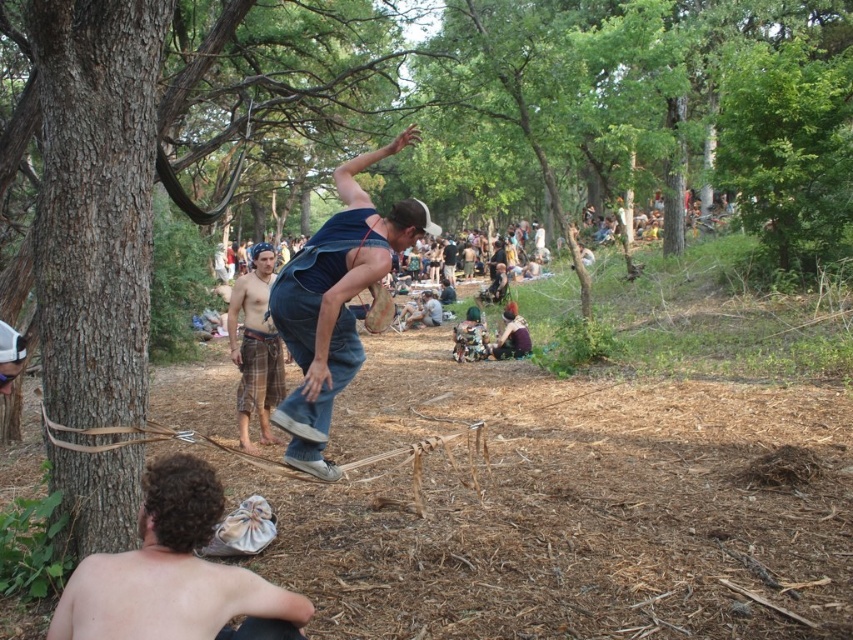
Who is taller, brown rough tree trunk at left or plaid fabric shorts at center?

Standing taller between the two is brown rough tree trunk at left.

I want to click on brown rough tree trunk at left, so click(x=96, y=202).

The image size is (853, 640). I want to click on brown rough tree trunk at left, so click(x=96, y=202).

The width and height of the screenshot is (853, 640). What are the coordinates of `brown rough tree trunk at left` in the screenshot? It's located at (96, 202).

Is curly hair at lower left to the right of plaid fabric shorts at center from the viewer's perspective?

Correct, you'll find curly hair at lower left to the right of plaid fabric shorts at center.

Can you confirm if curly hair at lower left is positioned above plaid fabric shorts at center?

Actually, curly hair at lower left is below plaid fabric shorts at center.

This screenshot has width=853, height=640. Find the location of `curly hair at lower left`. curly hair at lower left is located at coordinates (173, 573).

Between brown rough tree trunk at left and curly hair at lower left, which one is positioned lower?

curly hair at lower left is lower down.

Does brown rough tree trunk at left come behind curly hair at lower left?

Yes, it is.

I want to click on brown rough tree trunk at left, so click(x=96, y=202).